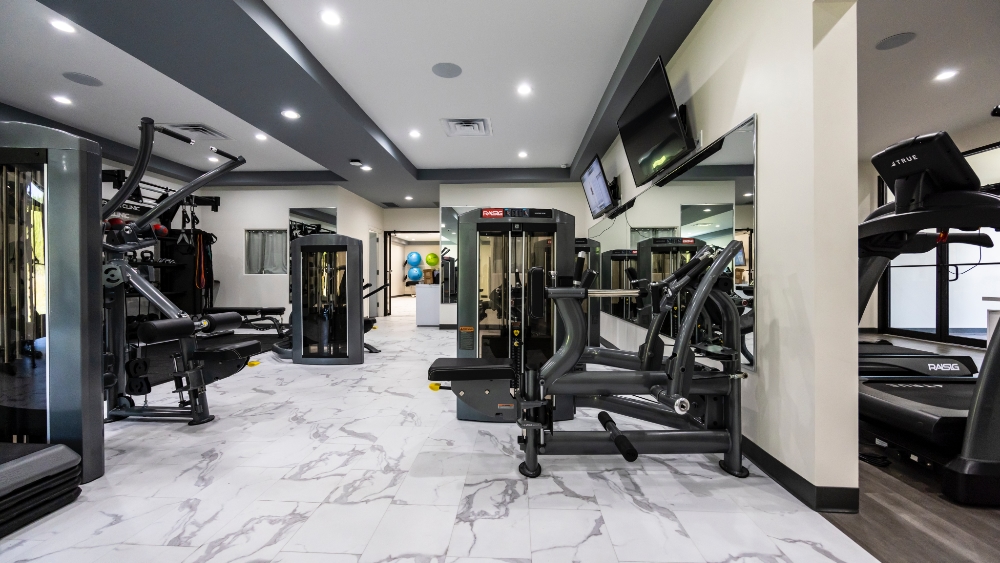
Find the location of a particular element. The height and width of the screenshot is (563, 1000). window is located at coordinates (266, 247).